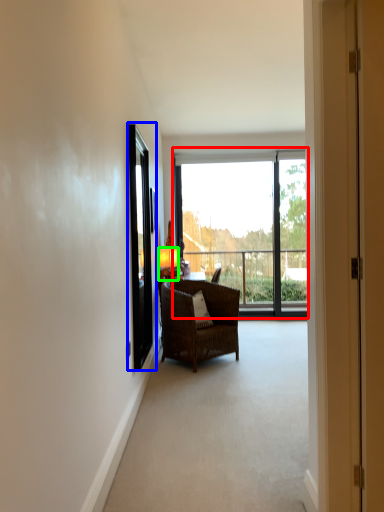
Question: Which object is the farthest from window (highlighted by a red box)? Choose among these: screen door (highlighted by a blue box) or lamp (highlighted by a green box).

Choices:
 (A) screen door
 (B) lamp

Answer: (A)